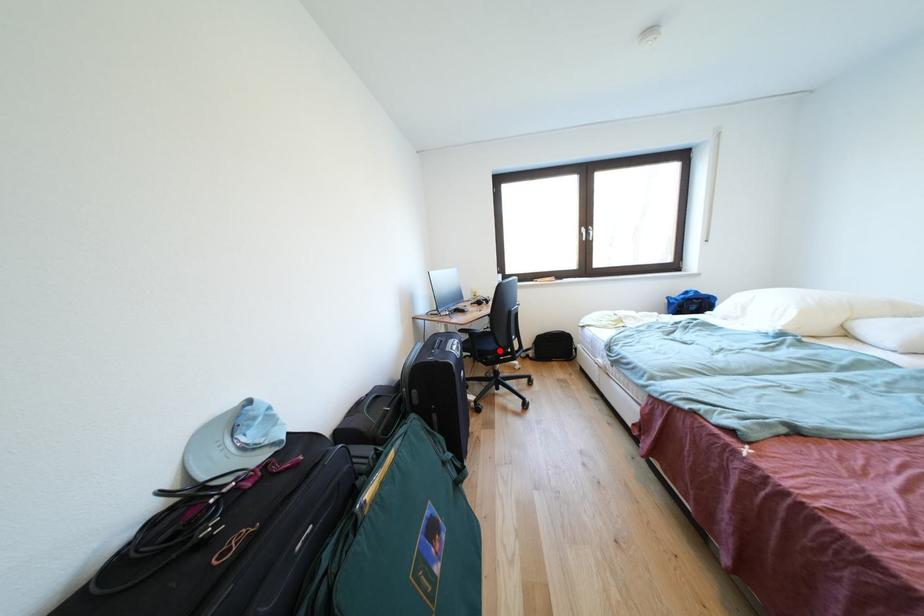
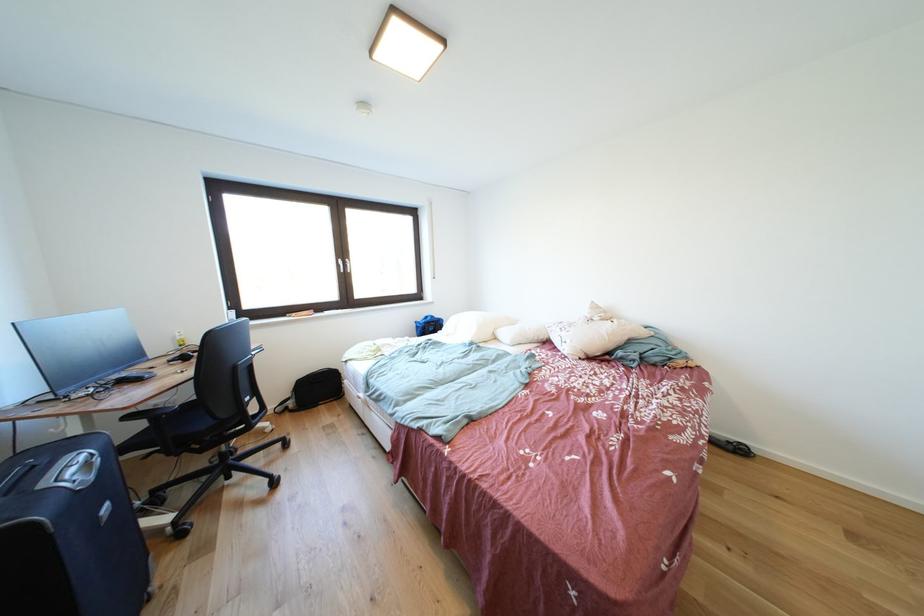
Find the pixel in the second image that matches the highlighted location in the first image.

(212, 429)